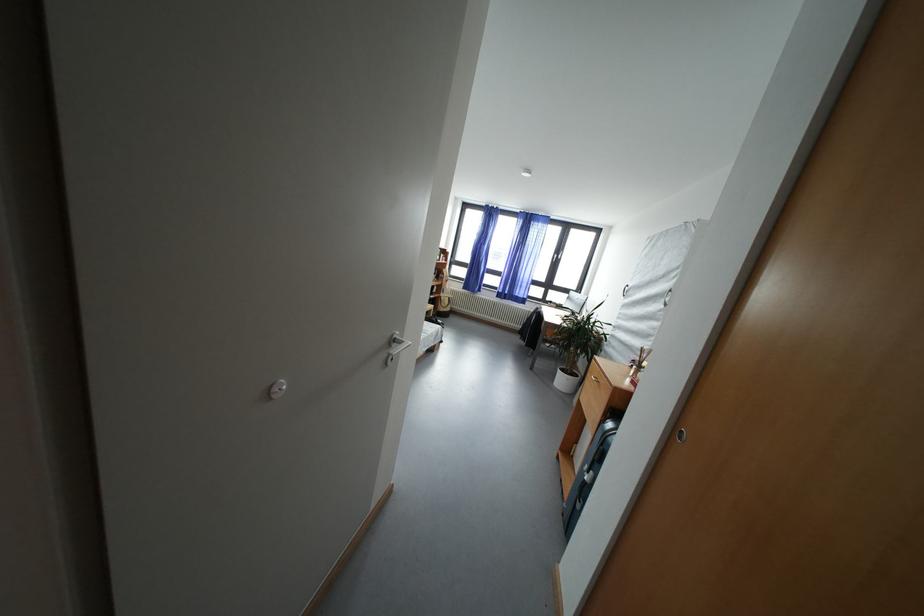
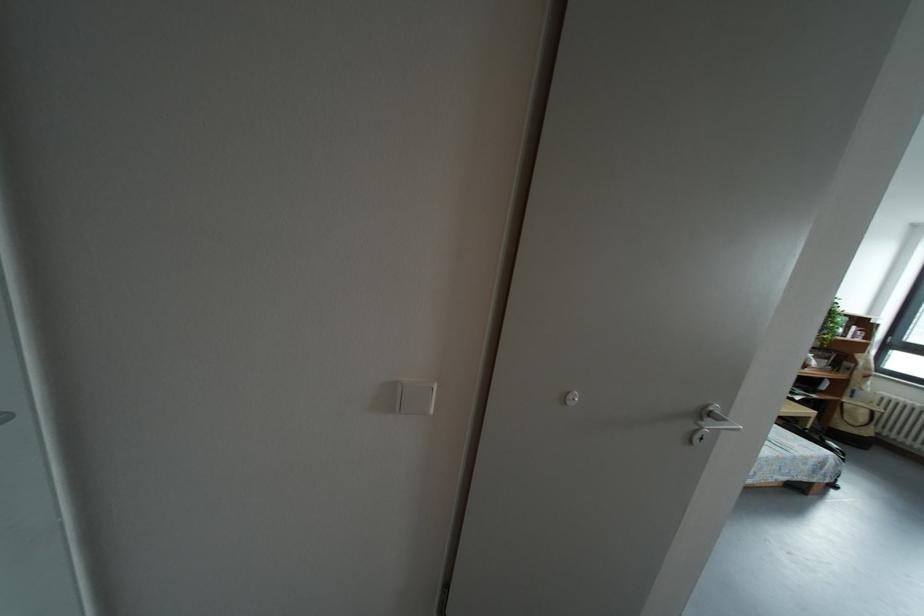
Find the pixel in the second image that matches the point at 402,345 in the first image.

(718, 419)